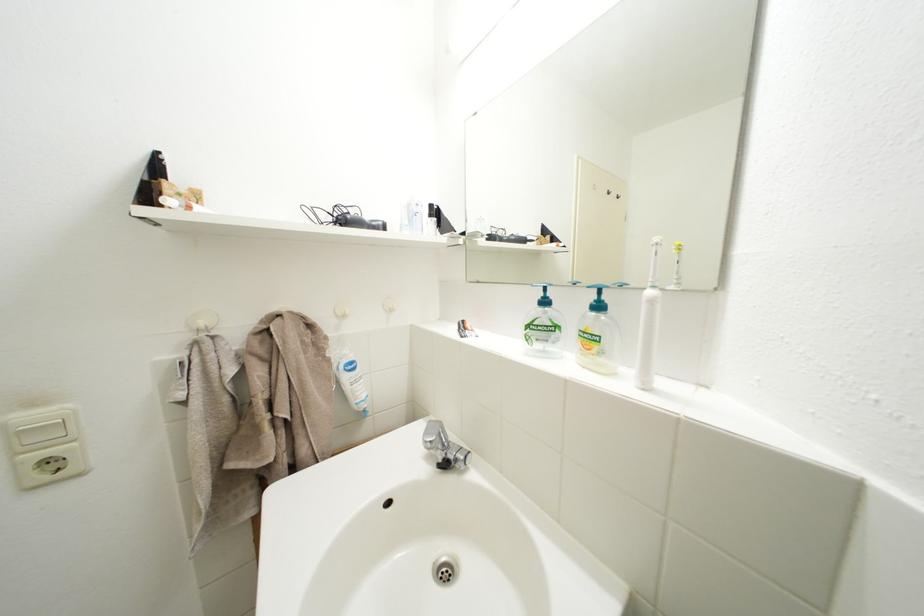
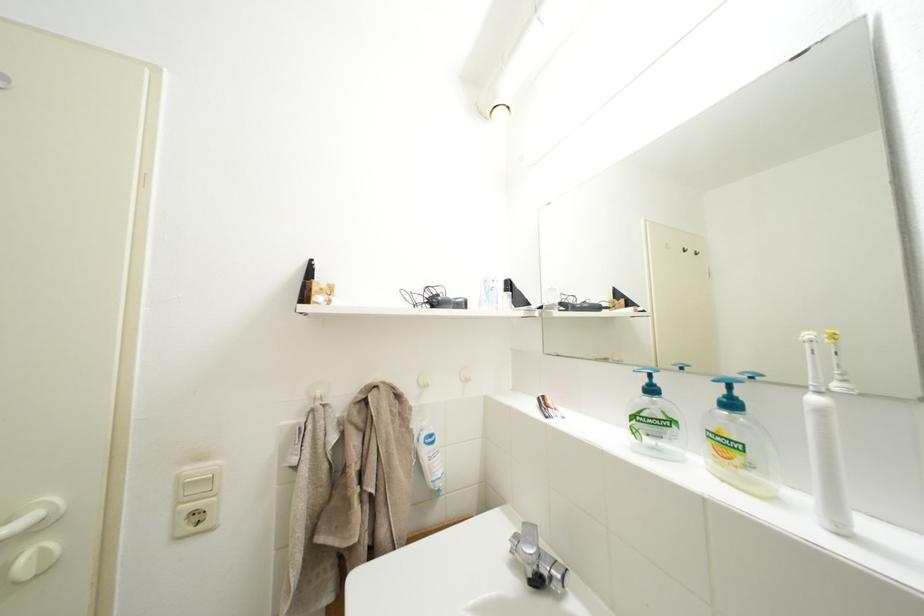
In the second image, find the point that corresponds to (x=659, y=298) in the first image.

(823, 405)